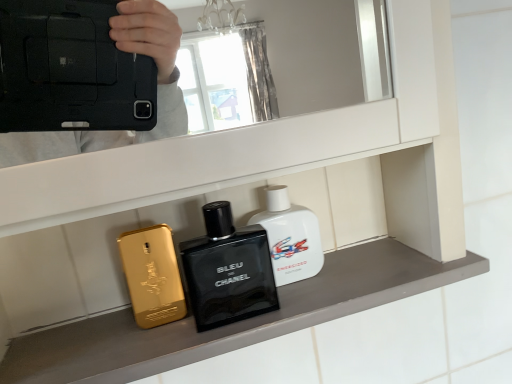
What do you see at coordinates (152, 275) in the screenshot?
I see `gold metallic phone at left, positioned as the first perfume in left-to-right order` at bounding box center [152, 275].

The image size is (512, 384). In order to click on black glass perfume at center in this screenshot , I will do `click(228, 270)`.

This screenshot has width=512, height=384. Describe the element at coordinates (230, 324) in the screenshot. I see `metallic gold phone at center` at that location.

The height and width of the screenshot is (384, 512). I want to click on white glossy bottle at center, the 2th perfume in the left-to-right sequence, so click(x=290, y=237).

Can you confirm if gold metallic phone at left, positioned as the first perfume in left-to-right order, is shorter than metallic gold phone at center?

In fact, gold metallic phone at left, positioned as the first perfume in left-to-right order, may be taller than metallic gold phone at center.

Looking at this image, is gold metallic phone at left, the second perfume when ordered from right to left, facing away from metallic gold phone at center?

No, gold metallic phone at left, the second perfume when ordered from right to left, is not facing the opposite direction of metallic gold phone at center.

Measure the distance between gold metallic phone at left, the second perfume when ordered from right to left, and metallic gold phone at center.

The distance of gold metallic phone at left, the second perfume when ordered from right to left, from metallic gold phone at center is 11.32 centimeters.

Who is shorter, gold metallic phone at left, the second perfume when ordered from right to left, or white glossy bottle at center, the 2th perfume in the left-to-right sequence?

gold metallic phone at left, the second perfume when ordered from right to left.

From the image's perspective, does gold metallic phone at left, positioned as the first perfume in left-to-right order, appear lower than white glossy bottle at center, the first perfume positioned from the right?

Yes, from the image's perspective, gold metallic phone at left, positioned as the first perfume in left-to-right order, is beneath white glossy bottle at center, the first perfume positioned from the right.

Is there a large distance between gold metallic phone at left, the second perfume when ordered from right to left, and white glossy bottle at center, the 2th perfume in the left-to-right sequence?

No.

Which is behind, point (157, 313) or point (307, 227)?

The point (307, 227) is behind.

Is black glass perfume at center further to camera compared to metallic gold phone at center?

Yes, black glass perfume at center is further from the camera.

Where is `toiletry above the metallic gold phone at center (from a real-world perspective)`? The image size is (512, 384). toiletry above the metallic gold phone at center (from a real-world perspective) is located at coordinates (228, 270).

Looking at the image, does black glass perfume at center seem bigger or smaller compared to metallic gold phone at center?

Considering their sizes, black glass perfume at center takes up less space than metallic gold phone at center.

Is white glossy bottle at center, the 2th perfume in the left-to-right sequence, located outside metallic gold phone at center?

Yes, white glossy bottle at center, the 2th perfume in the left-to-right sequence, is outside of metallic gold phone at center.

At what (x,y) coordinates should I click in order to perform the action: click on mantle on the left of white glossy bottle at center, the first perfume positioned from the right. Please return your answer as a coordinate pair (x, y). Image resolution: width=512 pixels, height=384 pixels. Looking at the image, I should click on (230, 324).

Is white glossy bottle at center, the first perfume positioned from the right, facing towards metallic gold phone at center?

No, white glossy bottle at center, the first perfume positioned from the right, is not oriented towards metallic gold phone at center.

Which of these two, white glossy bottle at center, the 2th perfume in the left-to-right sequence, or metallic gold phone at center, is thinner?

With smaller width is white glossy bottle at center, the 2th perfume in the left-to-right sequence.

Which is in front, point (346, 255) or point (160, 241)?

The point (160, 241) is in front.

Is metallic gold phone at center taller than gold metallic phone at left, the second perfume when ordered from right to left?

No, metallic gold phone at center is not taller than gold metallic phone at left, the second perfume when ordered from right to left.

Is metallic gold phone at center positioned with its back to gold metallic phone at left, the second perfume when ordered from right to left?

No, metallic gold phone at center is not facing away from gold metallic phone at left, the second perfume when ordered from right to left.

Can you confirm if metallic gold phone at center is thinner than gold metallic phone at left, positioned as the first perfume in left-to-right order?

No.

Is white glossy bottle at center, the 2th perfume in the left-to-right sequence, facing towards black glass perfume at center?

No, white glossy bottle at center, the 2th perfume in the left-to-right sequence, is not oriented towards black glass perfume at center.

Where is `toiletry below the white glossy bottle at center, the first perfume positioned from the right (from the image's perspective)`? toiletry below the white glossy bottle at center, the first perfume positioned from the right (from the image's perspective) is located at coordinates (228, 270).

Measure the distance from white glossy bottle at center, the 2th perfume in the left-to-right sequence, to black glass perfume at center.

white glossy bottle at center, the 2th perfume in the left-to-right sequence, and black glass perfume at center are 5.07 centimeters apart.

Based on the photo, from the image's perspective, which one is positioned higher, white glossy bottle at center, the first perfume positioned from the right, or black glass perfume at center?

→ white glossy bottle at center, the first perfume positioned from the right, appears higher in the image.

Is black glass perfume at center directly adjacent to gold metallic phone at left, the second perfume when ordered from right to left?

Absolutely, black glass perfume at center is next to and touching gold metallic phone at left, the second perfume when ordered from right to left.

Is black glass perfume at center further to camera compared to gold metallic phone at left, positioned as the first perfume in left-to-right order?

No, it is not.

From a real-world perspective, does black glass perfume at center stand above gold metallic phone at left, the second perfume when ordered from right to left?

Yes.

Does black glass perfume at center have a larger size compared to gold metallic phone at left, positioned as the first perfume in left-to-right order?

Correct, black glass perfume at center is larger in size than gold metallic phone at left, positioned as the first perfume in left-to-right order.

Image resolution: width=512 pixels, height=384 pixels. In order to click on the 1st perfume positioned above the metallic gold phone at center (from the image's perspective) in this screenshot , I will do `click(152, 275)`.

You are a GUI agent. You are given a task and a screenshot of the screen. Output one action in this format:
    pyautogui.click(x=<x>, y=<y>)
    Task: Click on the perfume located behind the gold metallic phone at left, positioned as the first perfume in left-to-right order
    The height and width of the screenshot is (384, 512).
    Given the screenshot: What is the action you would take?
    pyautogui.click(x=290, y=237)

Which object lies nearer to the anchor point white glossy bottle at center, the 2th perfume in the left-to-right sequence, metallic gold phone at center or black glass perfume at center?

black glass perfume at center is positioned closer to the anchor white glossy bottle at center, the 2th perfume in the left-to-right sequence.

Looking at the image, which one is located closer to gold metallic phone at left, positioned as the first perfume in left-to-right order, black glass perfume at center or white glossy bottle at center, the first perfume positioned from the right?

black glass perfume at center is closer to gold metallic phone at left, positioned as the first perfume in left-to-right order.

From the image, which object appears to be farther from metallic gold phone at center, gold metallic phone at left, positioned as the first perfume in left-to-right order, or black glass perfume at center?

Among the two, gold metallic phone at left, positioned as the first perfume in left-to-right order, is located further to metallic gold phone at center.

When comparing their distances from black glass perfume at center, does metallic gold phone at center or white glossy bottle at center, the first perfume positioned from the right, seem further?

Among the two, metallic gold phone at center is located further to black glass perfume at center.

Looking at this image, looking at the image, which one is located closer to white glossy bottle at center, the 2th perfume in the left-to-right sequence, gold metallic phone at left, positioned as the first perfume in left-to-right order, or black glass perfume at center?

Among the two, black glass perfume at center is located nearer to white glossy bottle at center, the 2th perfume in the left-to-right sequence.

Based on their spatial positions, is white glossy bottle at center, the first perfume positioned from the right, or metallic gold phone at center further from black glass perfume at center?

Among the two, metallic gold phone at center is located further to black glass perfume at center.

When comparing their distances from metallic gold phone at center, does black glass perfume at center or white glossy bottle at center, the 2th perfume in the left-to-right sequence, seem further?

The object further to metallic gold phone at center is white glossy bottle at center, the 2th perfume in the left-to-right sequence.

Looking at the image, which one is located further to gold metallic phone at left, positioned as the first perfume in left-to-right order, black glass perfume at center or metallic gold phone at center?

metallic gold phone at center lies further to gold metallic phone at left, positioned as the first perfume in left-to-right order, than the other object.

At what (x,y) coordinates should I click in order to perform the action: click on toiletry between gold metallic phone at left, positioned as the first perfume in left-to-right order, and white glossy bottle at center, the first perfume positioned from the right. Please return your answer as a coordinate pair (x, y). This screenshot has width=512, height=384. Looking at the image, I should click on (228, 270).

You are a GUI agent. You are given a task and a screenshot of the screen. Output one action in this format:
    pyautogui.click(x=<x>, y=<y>)
    Task: Click on the mantle located between gold metallic phone at left, positioned as the first perfume in left-to-right order, and white glossy bottle at center, the first perfume positioned from the right, in the left-right direction
    The height and width of the screenshot is (384, 512).
    Given the screenshot: What is the action you would take?
    pyautogui.click(x=230, y=324)

You are a GUI agent. You are given a task and a screenshot of the screen. Output one action in this format:
    pyautogui.click(x=<x>, y=<y>)
    Task: Click on the toiletry between metallic gold phone at center and white glossy bottle at center, the first perfume positioned from the right, along the z-axis
    
    Given the screenshot: What is the action you would take?
    click(x=228, y=270)

At what (x,y) coordinates should I click in order to perform the action: click on toiletry located between gold metallic phone at left, the second perfume when ordered from right to left, and metallic gold phone at center in the left-right direction. Please return your answer as a coordinate pair (x, y). This screenshot has width=512, height=384. Looking at the image, I should click on [x=228, y=270].